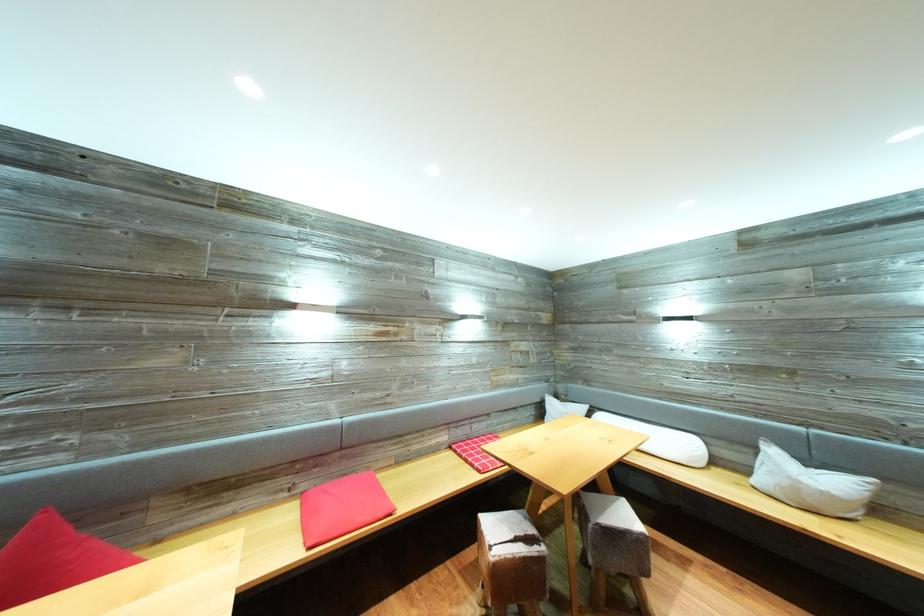
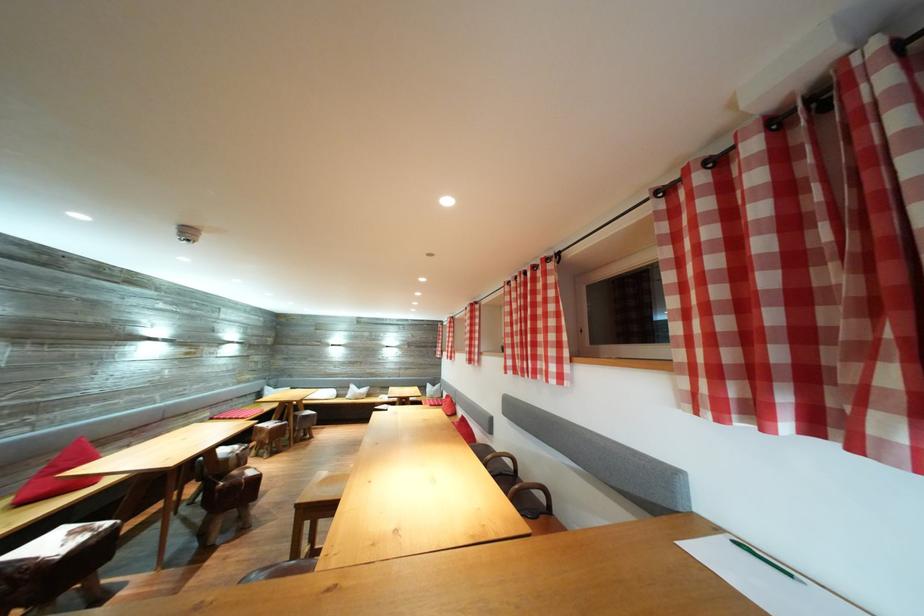
In the second image, find the point that corresponds to (888,517) in the first image.

(375, 400)